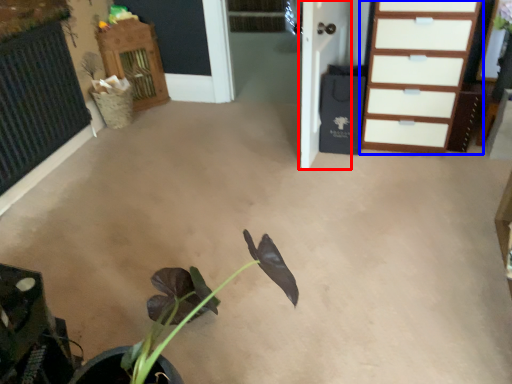
Question: Which point is further to the camera, door (highlighted by a red box) or chest of drawers (highlighted by a blue box)?

Choices:
 (A) door
 (B) chest of drawers

Answer: (B)